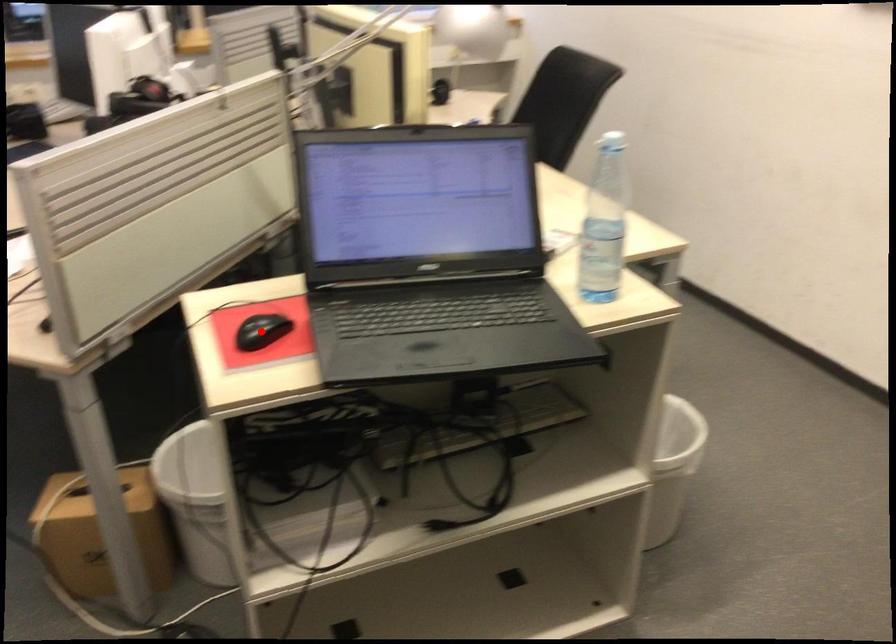
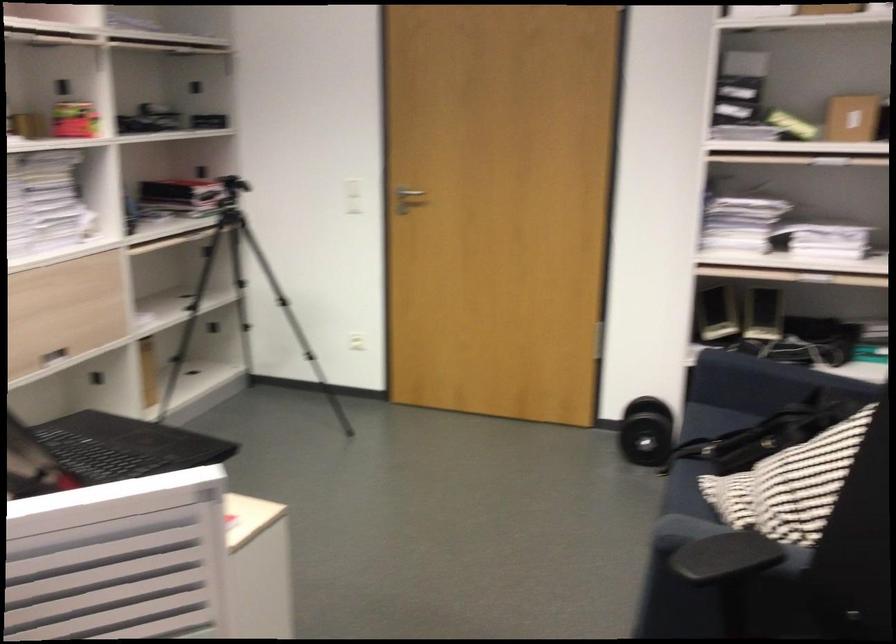
Question: I am providing you with two images of the same scene from different viewpoints. A red point is marked on the first image. Can you still see the location of the red point in image 2?

Choices:
 (A) Yes
 (B) No

Answer: (B)